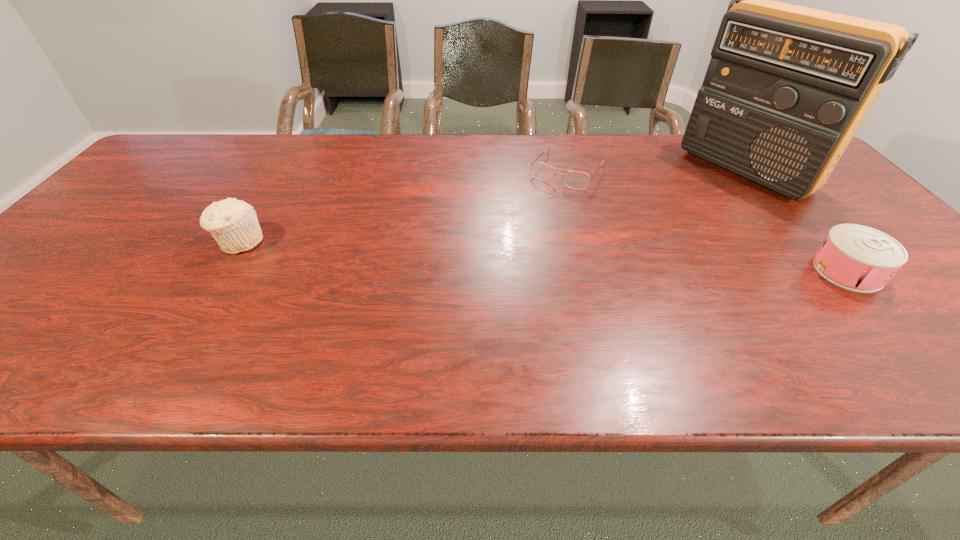
Find the location of a particular element. empty location between the third shortest object and the shortest object is located at coordinates (403, 207).

Find the location of a particular element. The width and height of the screenshot is (960, 540). vacant region between the second object from left to right and the tallest object is located at coordinates (657, 171).

At what (x,y) coordinates should I click in order to perform the action: click on free space between the spectacles and the radio receiver. Please return your answer as a coordinate pair (x, y). The image size is (960, 540). Looking at the image, I should click on (657, 171).

The height and width of the screenshot is (540, 960). I want to click on empty space that is in between the third shortest object and the spectacles, so click(x=403, y=207).

Image resolution: width=960 pixels, height=540 pixels. Identify the location of the second closest object to the leftmost object. (787, 87).

You are a GUI agent. You are given a task and a screenshot of the screen. Output one action in this format:
    pyautogui.click(x=<x>, y=<y>)
    Task: Click on the object that stands as the third closest to the shortest object
    
    Given the screenshot: What is the action you would take?
    pyautogui.click(x=233, y=223)

Identify the location of free region that satisfies the following two spatial constraints: 1. on the front side of the tallest object; 2. on the left side of the third tallest object. Image resolution: width=960 pixels, height=540 pixels. (828, 271).

Identify the location of vacant space that satisfies the following two spatial constraints: 1. on the back side of the muffin; 2. on the left side of the third object from right to left. The width and height of the screenshot is (960, 540). (283, 171).

This screenshot has width=960, height=540. I want to click on vacant space that satisfies the following two spatial constraints: 1. on the front side of the can; 2. on the left side of the spectacles, so click(x=594, y=271).